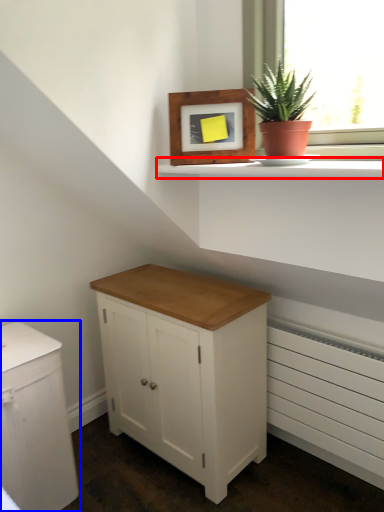
Question: Which object appears farthest to the camera in this image, window sill (highlighted by a red box) or chest of drawers (highlighted by a blue box)?

Choices:
 (A) window sill
 (B) chest of drawers

Answer: (B)